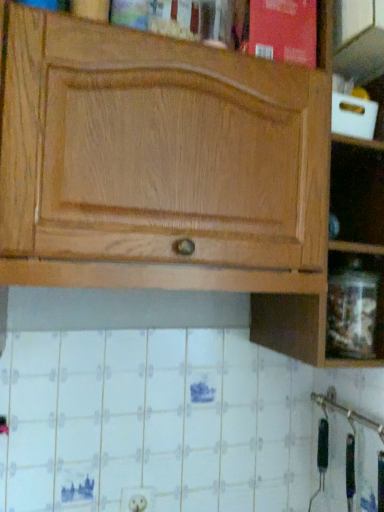
Question: In which direction should I rotate to look at white plastic electric outlet at lower center?

Choices:
 (A) left
 (B) right

Answer: (A)

Question: Is natural wood cabinet at upper center at the back of white plastic electric outlet at lower center?

Choices:
 (A) no
 (B) yes

Answer: (A)

Question: Is white plastic electric outlet at lower center facing towards natural wood cabinet at upper center?

Choices:
 (A) yes
 (B) no

Answer: (B)

Question: Is white plastic electric outlet at lower center further to the viewer compared to natural wood cabinet at upper center?

Choices:
 (A) no
 (B) yes

Answer: (B)

Question: Is white plastic electric outlet at lower center outside of natural wood cabinet at upper center?

Choices:
 (A) yes
 (B) no

Answer: (A)

Question: Does white plastic electric outlet at lower center appear on the left side of natural wood cabinet at upper center?

Choices:
 (A) no
 (B) yes

Answer: (B)

Question: Does white plastic electric outlet at lower center lie in front of natural wood cabinet at upper center?

Choices:
 (A) yes
 (B) no

Answer: (B)

Question: Can you confirm if white plastic electric outlet at lower center is positioned to the right of transparent glass jar at lower right?

Choices:
 (A) yes
 (B) no

Answer: (B)

Question: Is white plastic electric outlet at lower center thinner than transparent glass jar at lower right?

Choices:
 (A) no
 (B) yes

Answer: (B)

Question: Is white plastic electric outlet at lower center positioned behind transparent glass jar at lower right?

Choices:
 (A) no
 (B) yes

Answer: (B)

Question: Can you confirm if white plastic electric outlet at lower center is taller than transparent glass jar at lower right?

Choices:
 (A) no
 (B) yes

Answer: (A)

Question: Is white plastic electric outlet at lower center not within transparent glass jar at lower right?

Choices:
 (A) no
 (B) yes

Answer: (B)

Question: Does white plastic electric outlet at lower center appear on the left side of transparent glass jar at lower right?

Choices:
 (A) yes
 (B) no

Answer: (A)

Question: Can you confirm if natural wood cabinet at upper center is shorter than white plastic electric outlet at lower center?

Choices:
 (A) no
 (B) yes

Answer: (A)